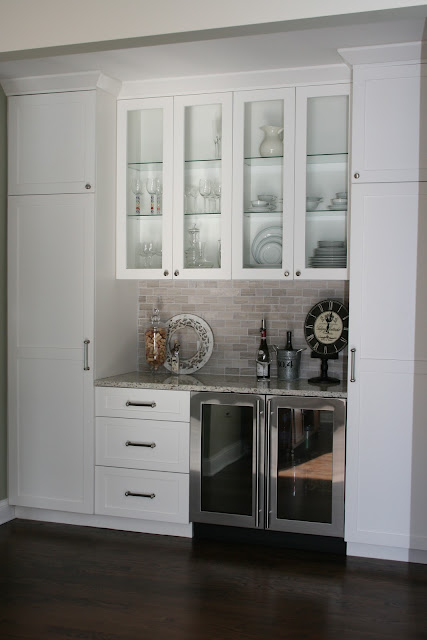
You are a GUI agent. You are given a task and a screenshot of the screen. Output one action in this format:
    pyautogui.click(x=<x>, y=<y>)
    Task: Click on the handle
    Image resolution: width=427 pixels, height=640 pixels.
    Given the screenshot: What is the action you would take?
    pyautogui.click(x=144, y=493)